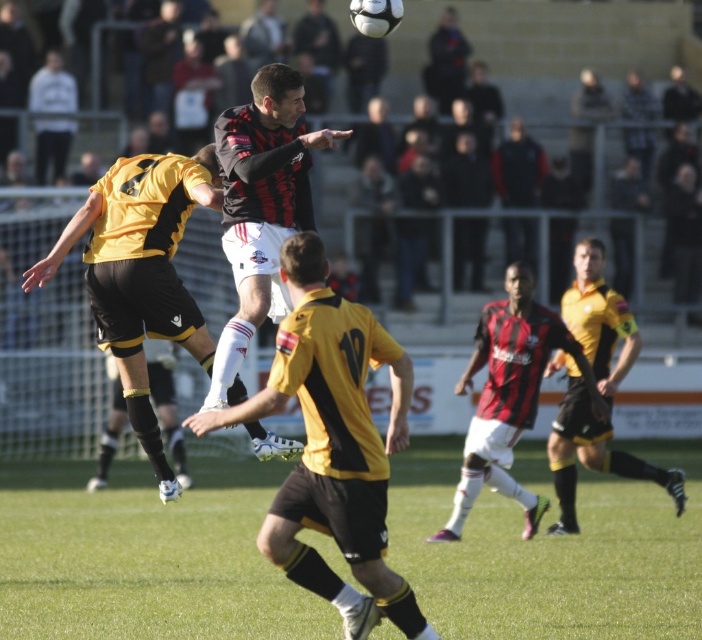
Question: Observing the image, what is the correct spatial positioning of green grass at center in reference to black and red striped jersey at center?

Choices:
 (A) right
 (B) left

Answer: (B)

Question: Which object appears farthest from the camera in this image?

Choices:
 (A) matte red soccer jersey at center
 (B) black and red striped jersey at center
 (C) yellow/black jersey at left
 (D) yellow/black jersey at center

Answer: (A)

Question: Which object is positioned closest to the yellow jersey at right?

Choices:
 (A) matte red soccer jersey at center
 (B) green grass at center
 (C) black and red striped jersey at center
 (D) yellow/black jersey at left

Answer: (A)

Question: Which of the following is the closest to the observer?

Choices:
 (A) green grass at center
 (B) black and red striped jersey at center
 (C) yellow/black jersey at center

Answer: (C)

Question: From the image, what is the correct spatial relationship of yellow/black jersey at left in relation to yellow jersey at right?

Choices:
 (A) above
 (B) below

Answer: (A)

Question: Does yellow/black jersey at left appear on the left side of yellow jersey at right?

Choices:
 (A) no
 (B) yes

Answer: (B)